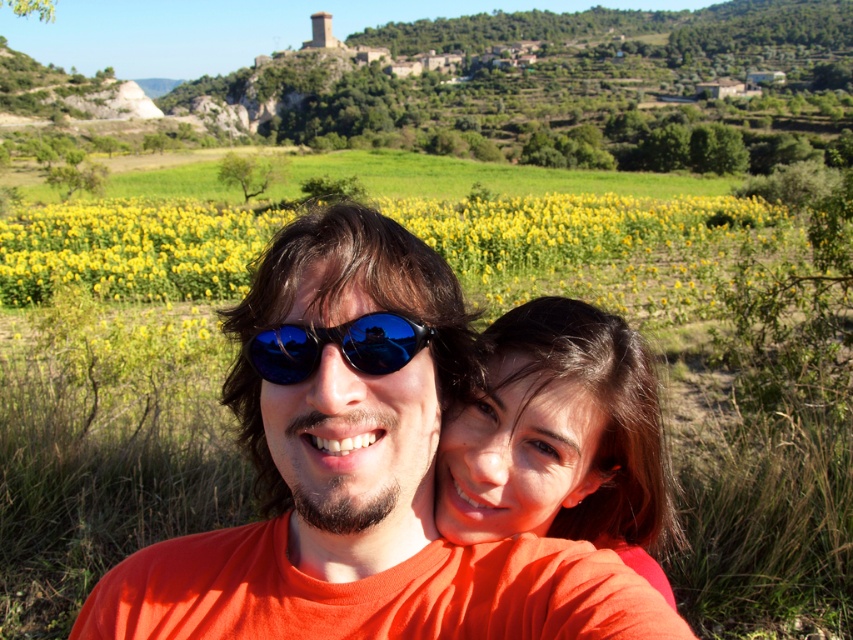
You are standing in the rural setting and want to move from point A to point B. Point A is at coordinate point (311, 465) and point B is at coordinate point (343, 330). Which point is closer to you as you start your journey?

Point A at coordinate point (311, 465) is closer to you since it is further to the viewer than point B at coordinate point (343, 330).